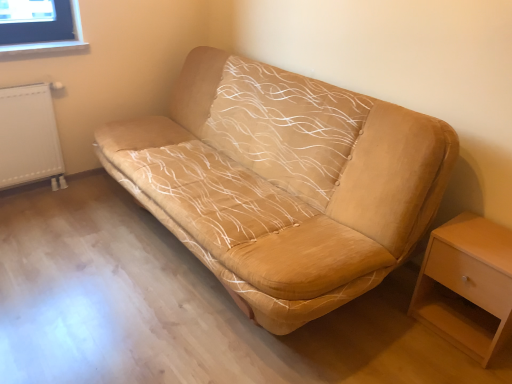
Identify the location of vacant space in front of white textured radiator at left. (33, 212).